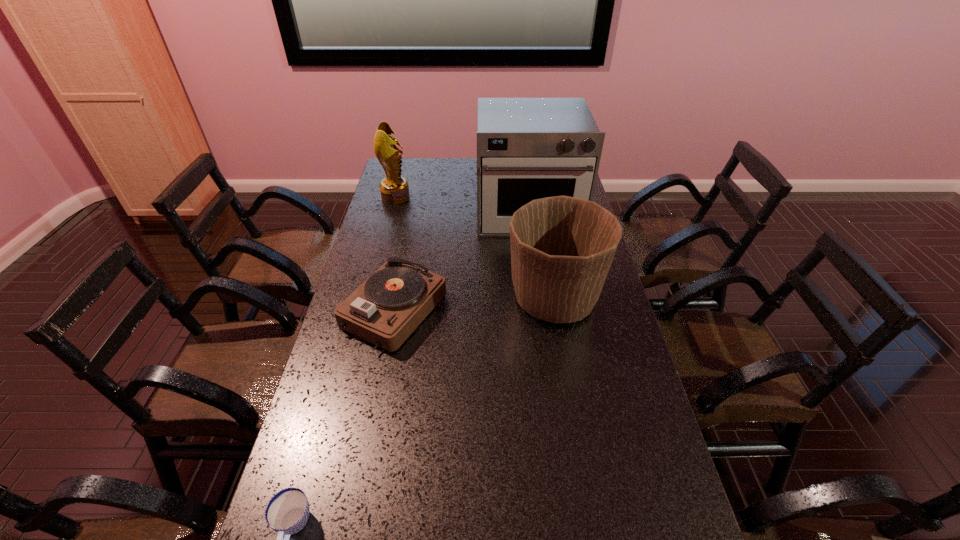
Where is `toaster oven`? This screenshot has width=960, height=540. toaster oven is located at coordinates (527, 148).

Find the location of a particular element. award is located at coordinates (394, 189).

At what (x,y) coordinates should I click in order to perform the action: click on flowerpot. Please return your answer as a coordinate pair (x, y). This screenshot has width=960, height=540. Looking at the image, I should click on (562, 247).

At what (x,y) coordinates should I click in order to perform the action: click on the second shortest object. Please return your answer as a coordinate pair (x, y). The height and width of the screenshot is (540, 960). Looking at the image, I should click on (386, 308).

Locate an element on the screen. The image size is (960, 540). free space located on the front panel of the tallest object is located at coordinates (535, 259).

I want to click on vacant position located 0.400m on the front-facing side of the award, so click(502, 197).

Where is `free space located 0.370m on the front of the flowerpot`? This screenshot has width=960, height=540. free space located 0.370m on the front of the flowerpot is located at coordinates (582, 455).

The image size is (960, 540). What are the coordinates of `vacant point located 0.210m on the back of the record player` in the screenshot? It's located at (409, 237).

At what (x,y) coordinates should I click in order to perform the action: click on award that is at the left edge. Please return your answer as a coordinate pair (x, y). The width and height of the screenshot is (960, 540). Looking at the image, I should click on (394, 189).

This screenshot has height=540, width=960. I want to click on record player present at the left edge, so click(x=386, y=308).